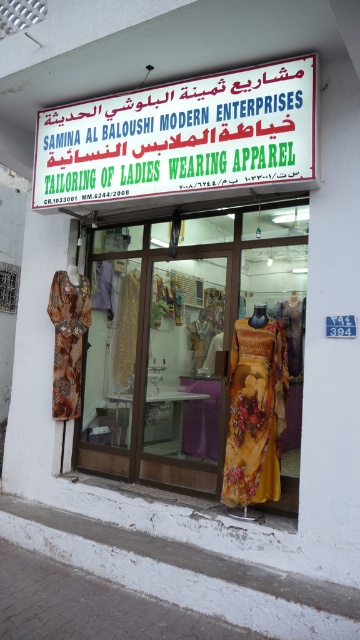
What is the color and material of the object located at point (x=181, y=140)?

The object at point (x=181, y=140) is a white plastic sign at upper center.

You are a customer entering the store through the glass doors. You see the white plastic sign at upper center and the floral silk dress at left. Which object will you see first as you walk through the entrance?

The white plastic sign at upper center is in front of the floral silk dress at left, so you will see the white plastic sign at upper center first as you walk through the entrance.